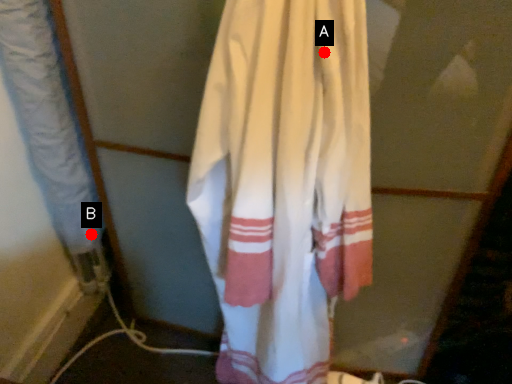
Question: Two points are circled on the image, labeled by A and B beside each circle. Which point is farther from the camera taking this photo?

Choices:
 (A) A is further
 (B) B is further

Answer: (B)